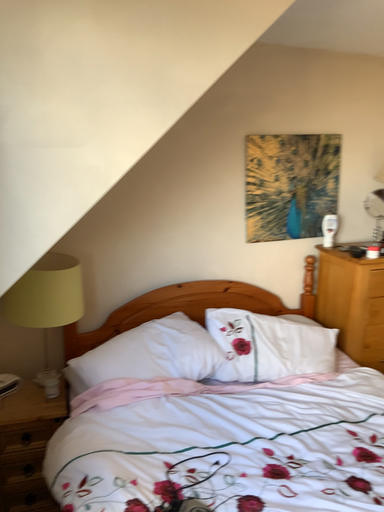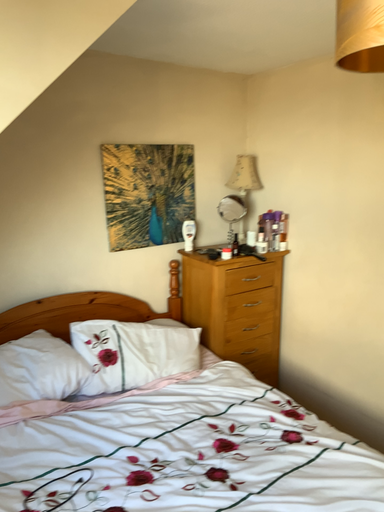
Question: How did the camera likely rotate when shooting the video?

Choices:
 (A) rotated right
 (B) rotated left

Answer: (A)